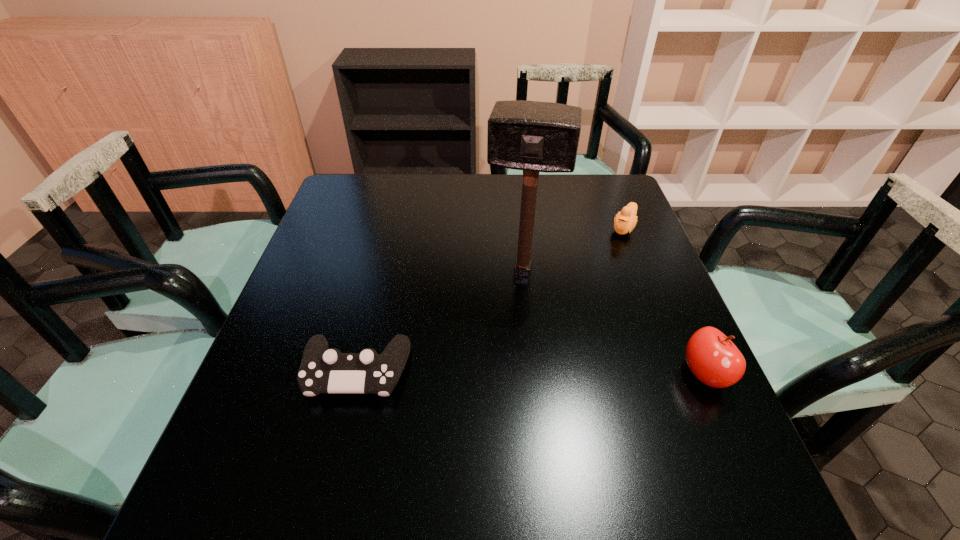
Find the location of a particular element. The height and width of the screenshot is (540, 960). object that is the third closest one to the control is located at coordinates (625, 221).

Identify the location of the closest object to the duckling. The width and height of the screenshot is (960, 540). (533, 136).

The height and width of the screenshot is (540, 960). I want to click on free space that satisfies the following two spatial constraints: 1. on the surface of the second tallest object; 2. on the stem of the leftmost object, so click(x=356, y=374).

Locate an element on the screen. free location that satisfies the following two spatial constraints: 1. on the front side of the third shortest object; 2. on the stem of the duckling is located at coordinates (682, 374).

Locate an element on the screen. This screenshot has width=960, height=540. vacant area in the image that satisfies the following two spatial constraints: 1. on the surface of the apple; 2. on the stem of the leftmost object is located at coordinates (356, 374).

The width and height of the screenshot is (960, 540). I want to click on free spot that satisfies the following two spatial constraints: 1. on the surface of the leftmost object; 2. on the stem of the apple, so click(x=356, y=374).

In order to click on vacant region that satisfies the following two spatial constraints: 1. on the front side of the duckling; 2. on the stem of the third shortest object in this screenshot , I will do `click(682, 374)`.

Identify the location of vacant space that satisfies the following two spatial constraints: 1. on the surface of the control; 2. on the stem of the third shortest object. (356, 374).

Where is `vacant position in the image that satisfies the following two spatial constraints: 1. on the surface of the leftmost object; 2. on the stem of the third shortest object`? vacant position in the image that satisfies the following two spatial constraints: 1. on the surface of the leftmost object; 2. on the stem of the third shortest object is located at coordinates (356, 374).

Identify the location of free spot that satisfies the following two spatial constraints: 1. on the surface of the control; 2. on the stem of the second tallest object. This screenshot has width=960, height=540. (356, 374).